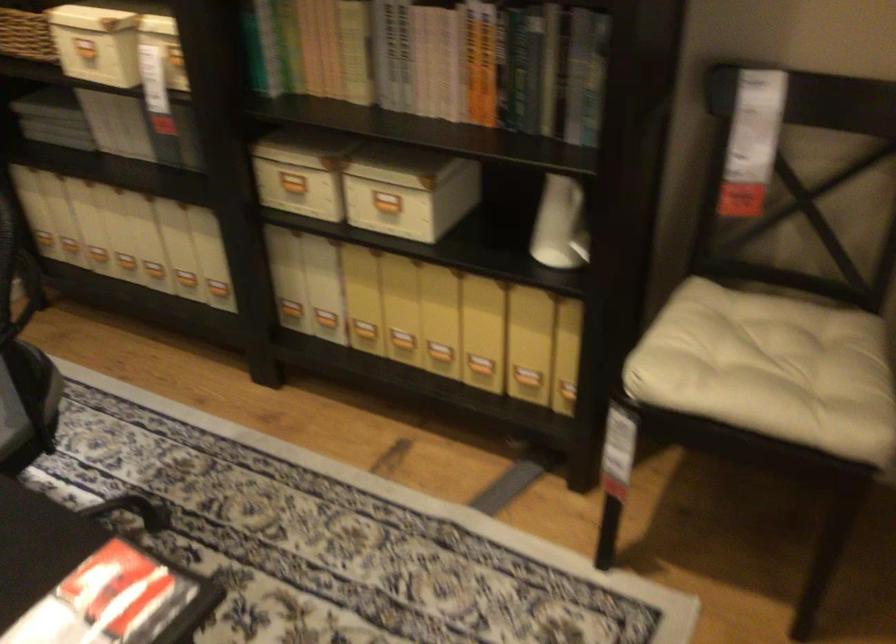
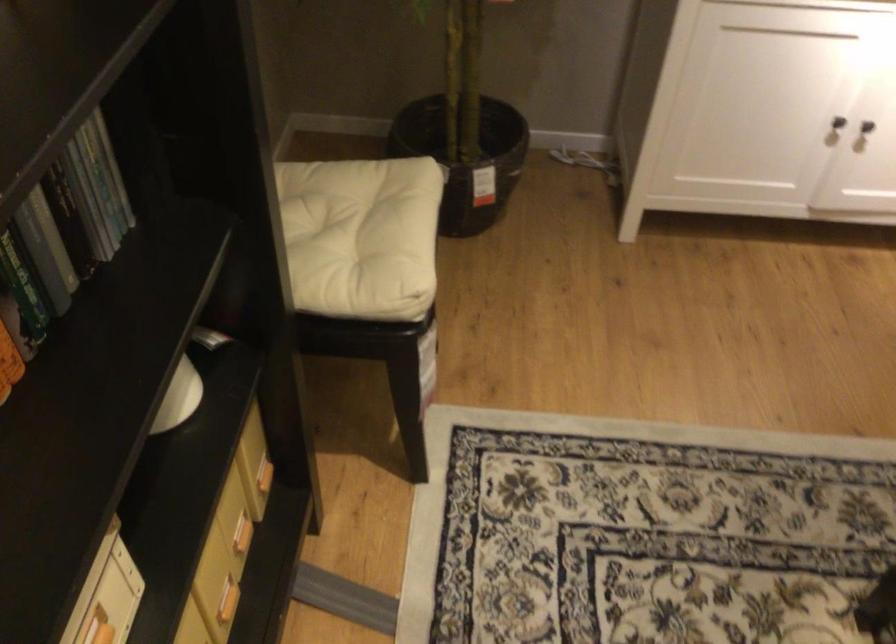
Find the pixel in the second image that matches [548,82] in the first image.

(30, 240)